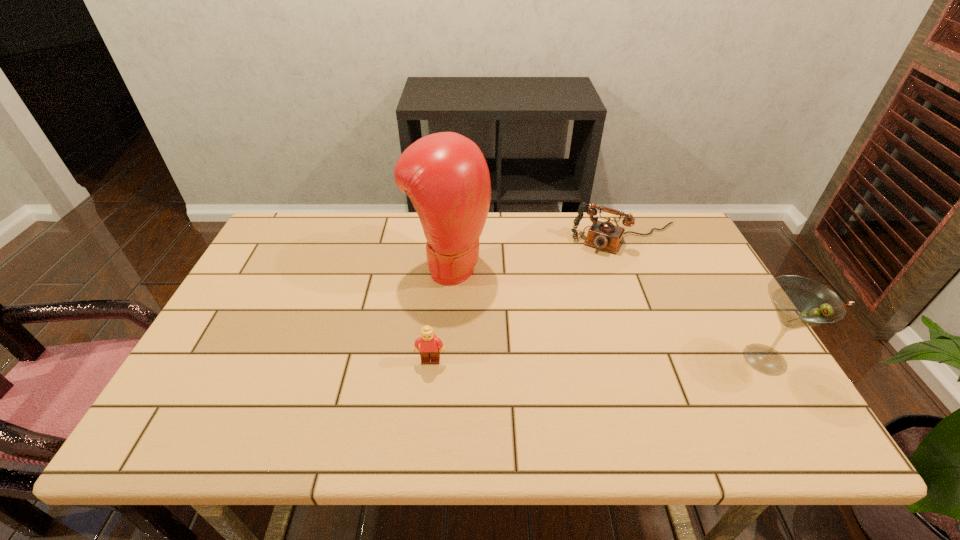
Locate an element on the screen. Image resolution: width=960 pixels, height=540 pixels. vacant spot on the desktop that is between the Lego and the third shortest object and is positioned on the striking surface of the tallest object is located at coordinates pos(626,360).

Locate an element on the screen. The width and height of the screenshot is (960, 540). vacant space on the desktop that is between the Lego and the second tallest object and is positioned on the dial of the telephone is located at coordinates (564, 360).